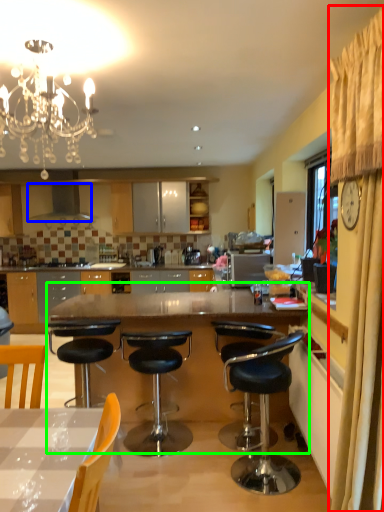
Question: Estimate the real-world distances between objects in this image. Which object is farther from curtain (highlighted by a red box), kitchen appliance (highlighted by a blue box) or table (highlighted by a green box)?

Choices:
 (A) kitchen appliance
 (B) table

Answer: (A)